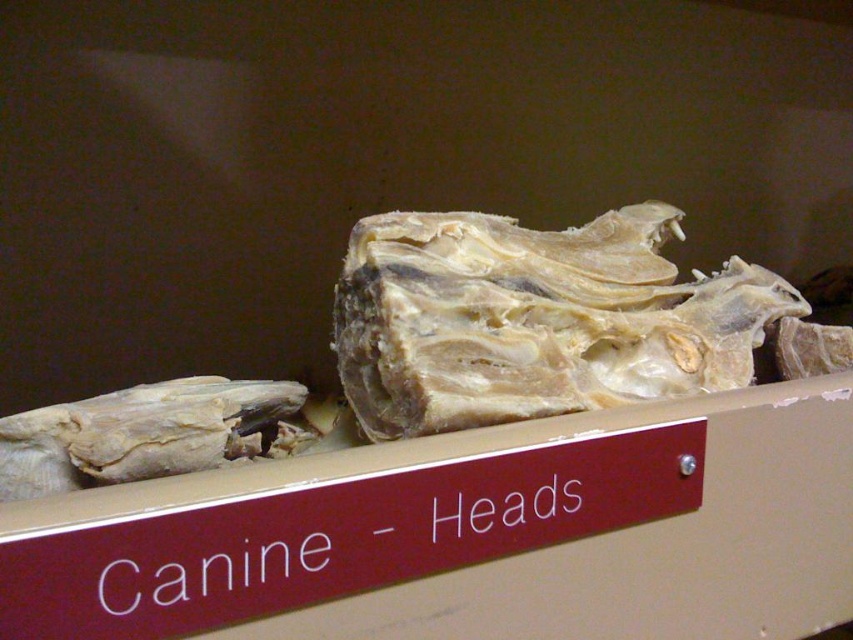
Question: Does white cardboard box at center appear over white fibrous bone at center?

Choices:
 (A) no
 (B) yes

Answer: (A)

Question: Which point is closer to the camera taking this photo?

Choices:
 (A) (486, 486)
 (B) (430, 356)

Answer: (A)

Question: Observing the image, what is the correct spatial positioning of white cardboard box at center in reference to white fibrous bone at center?

Choices:
 (A) below
 (B) above

Answer: (A)

Question: From the image, what is the correct spatial relationship of white cardboard box at center in relation to white fibrous bone at center?

Choices:
 (A) above
 (B) below

Answer: (B)

Question: Which point is closer to the camera taking this photo?

Choices:
 (A) (616, 506)
 (B) (579, 266)

Answer: (A)